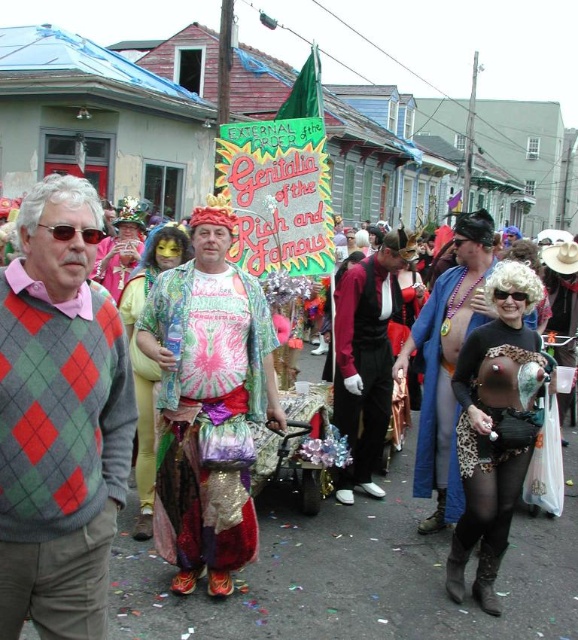
Question: Which object appears farthest from the camera in this image?

Choices:
 (A) leopard print skirt at center
 (B) argyle sweater at left
 (C) shiny pink sequins at center
 (D) tie-dye fabric skirt at center

Answer: (C)

Question: Which point appears closest to the camera in this image?

Choices:
 (A) (449, 344)
 (B) (144, 499)

Answer: (A)

Question: Is shiny metallic pants at center below shiny pink sequins at center?

Choices:
 (A) no
 (B) yes

Answer: (B)

Question: Among these objects, which one is nearest to the camera?

Choices:
 (A) shiny metallic pants at center
 (B) leopard print dress at center

Answer: (B)

Question: Is velvet black vest at center in front of shiny pink sequins at center?

Choices:
 (A) no
 (B) yes

Answer: (B)

Question: In this image, where is argyle sweater at left located relative to leopard print skirt at center?

Choices:
 (A) right
 (B) left

Answer: (B)